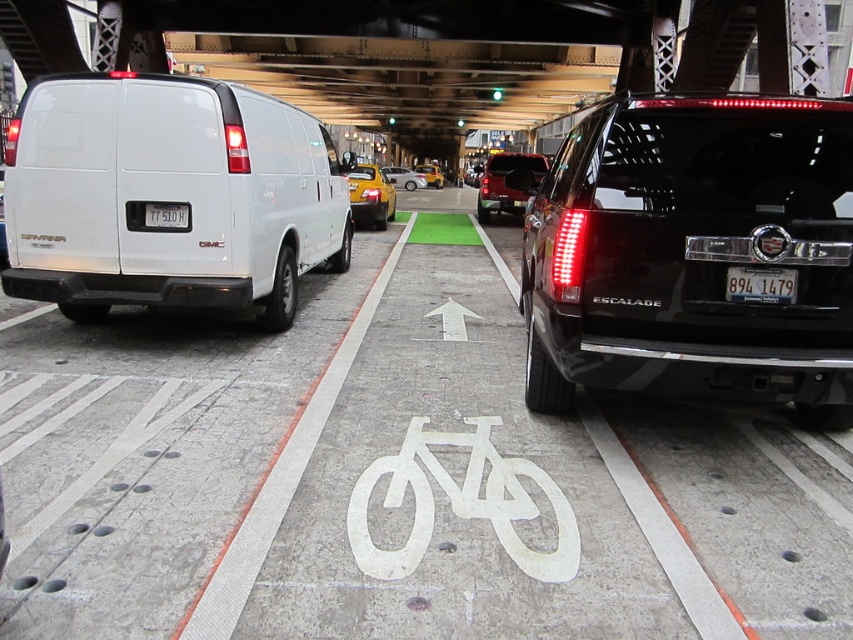
Does metallic silver sedan at center have a lesser height compared to yellow matte taxi cab at center?

Indeed, metallic silver sedan at center has a lesser height compared to yellow matte taxi cab at center.

Is point (386, 170) behind point (428, 177)?

That is False.

Identify the location of metallic silver sedan at center. This screenshot has width=853, height=640. (404, 177).

Who is more forward, (x=370, y=173) or (x=413, y=179)?

Point (x=370, y=173) is more forward.

Does yellow matte taxi at center lie behind metallic silver sedan at center?

That is False.

Who is more distant from viewer, (364, 172) or (396, 172)?

Positioned behind is point (396, 172).

The image size is (853, 640). Find the location of `yellow matte taxi at center`. yellow matte taxi at center is located at coordinates (370, 196).

Does white plastic license plate at center-right come behind metallic silver sedan at center?

No.

Can you confirm if white plastic license plate at center-right is positioned to the right of metallic silver sedan at center?

Indeed, white plastic license plate at center-right is positioned on the right side of metallic silver sedan at center.

Who is more forward, (747, 292) or (409, 170)?

Point (747, 292) is in front.

Locate an element on the screen. The image size is (853, 640). white plastic license plate at center-right is located at coordinates (761, 284).